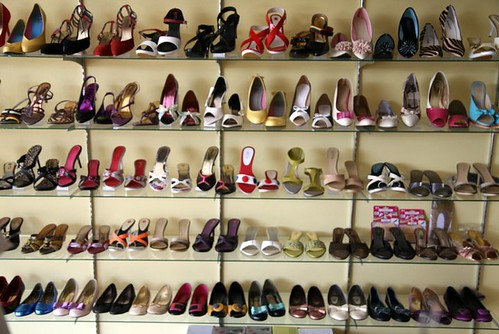
Identify the location of shelf support. (82, 68), (221, 63), (355, 67), (493, 143).